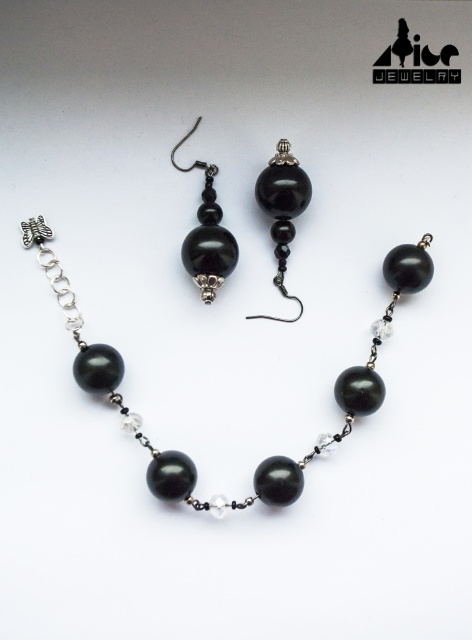
Does point (426, 275) lie behind point (259, 314)?

No, (426, 275) is closer to viewer.

Who is positioned more to the right, black pearl necklace at center or black glossy bead at center?

Positioned to the right is black glossy bead at center.

Image resolution: width=472 pixels, height=640 pixels. What do you see at coordinates (266, 458) in the screenshot?
I see `black pearl necklace at center` at bounding box center [266, 458].

Locate an element on the screen. This screenshot has height=640, width=472. black pearl necklace at center is located at coordinates (266, 458).

Which is behind, point (277, 205) or point (228, 253)?

Positioned behind is point (228, 253).

This screenshot has height=640, width=472. I want to click on black glossy bead at center, so click(x=283, y=209).

Does black pearl necklace at center come in front of black glass bead at center?

That is True.

You are a GUI agent. You are given a task and a screenshot of the screen. Output one action in this format:
    pyautogui.click(x=<x>, y=<y>)
    Task: Click on the black pearl necklace at center
    
    Given the screenshot: What is the action you would take?
    pyautogui.click(x=266, y=458)